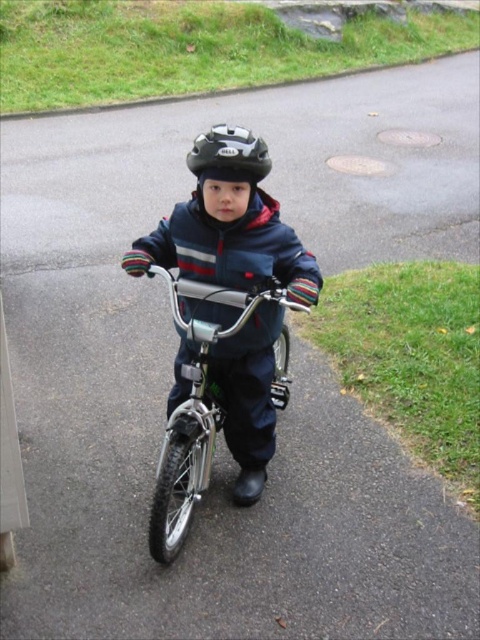
Does point (157, 470) come farther from viewer compared to point (220, 129)?

Yes, it is behind point (220, 129).

Locate an element on the screen. shiny metallic bicycle at center is located at coordinates (195, 410).